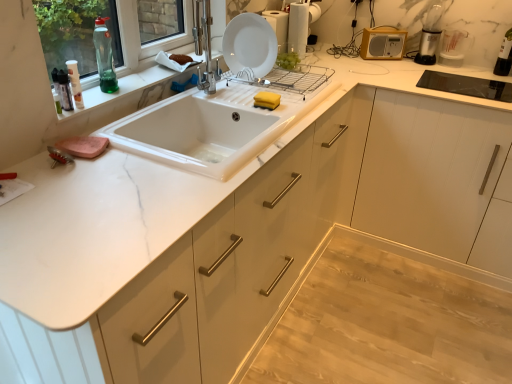
Question: From the image's perspective, is transparent plastic measuring cup at upper right, the 2th appliance in the left-to-right sequence, above or below light wood floor at lower right?

Choices:
 (A) below
 (B) above

Answer: (B)

Question: Is transparent plastic measuring cup at upper right, the 2th appliance in the left-to-right sequence, in front of or behind light wood floor at lower right in the image?

Choices:
 (A) behind
 (B) front

Answer: (A)

Question: Considering the real-world distances, which object is farthest from the marble window sill at upper left?

Choices:
 (A) translucent plastic spray bottle at upper left, marked as the third bottle in a back-to-front arrangement
 (B) white glossy drawer at center
 (C) white glossy plate at upper center
 (D) green glass bottle at upper left, the 2th bottle from the front
 (E) white marble sink at center

Answer: (B)

Question: Considering the real-world distances, which object is closest to the translucent plastic spray bottle at upper left, placed as the 3th bottle when sorted from top to bottom?

Choices:
 (A) white glossy drawer at center
 (B) yellow matte radio at upper right, which is the second appliance in right-to-left order
 (C) white marble sink at center
 (D) transparent plastic bottle at upper right, which is counted as the 3th bottle, starting from the left
 (E) transparent plastic measuring cup at upper right, the 2th appliance in the left-to-right sequence

Answer: (C)